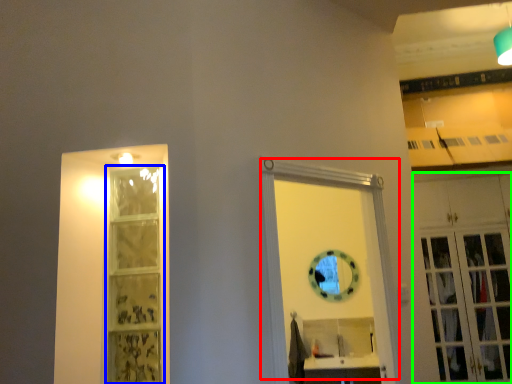
Question: Which object is the farthest from door (highlighted by a red box)? Choose among these: shelf (highlighted by a blue box) or cabinetry (highlighted by a green box).

Choices:
 (A) shelf
 (B) cabinetry

Answer: (B)